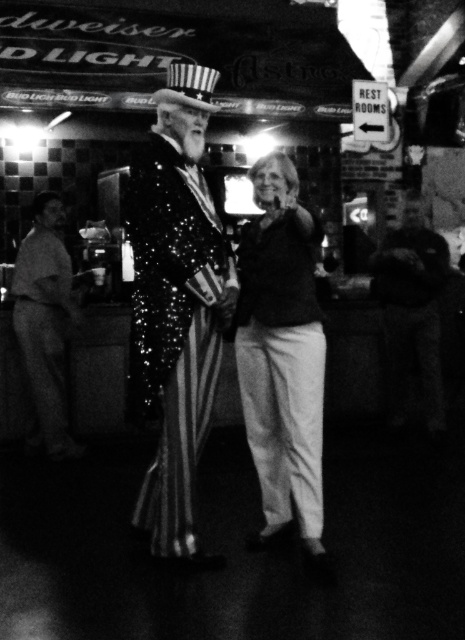
What is located at the point with coordinates (175, 307) in the image?

The point at (175, 307) indicates a sparkly sequined sailor at center.

You are a photographer trying to capture a clear shot of both the sparkly sequined sailor at center and the smooth brown leather jacket at left. Since the image is taken at night with limited lighting, you want to ensure both subjects are properly illuminated. Which subject should you focus your camera on first to ensure it is well lit?

The sparkly sequined sailor at center is above the smooth brown leather jacket at left, so focusing on the sparkly sequined sailor at center first would ensure it is well lit since it is higher up and likely in the brighter foreground.

Based on the scene described, which object is smaller in size between the sparkly sequined sailor at center and the matte black shirt at center?

The sparkly sequined sailor at center is smaller than the matte black shirt at center.